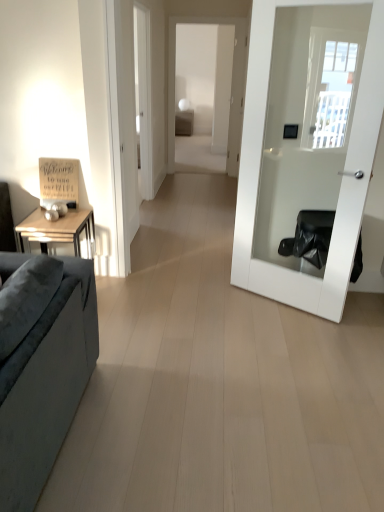
Where is `free space in front of white glossy door at right`? free space in front of white glossy door at right is located at coordinates (293, 349).